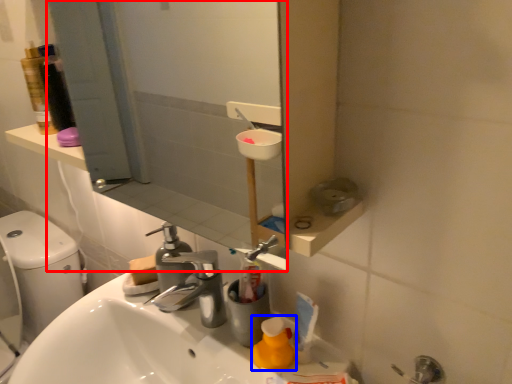
Question: Among these objects, which one is farthest to the camera, mirror (highlighted by a red box) or cleaning product (highlighted by a blue box)?

Choices:
 (A) mirror
 (B) cleaning product

Answer: (B)